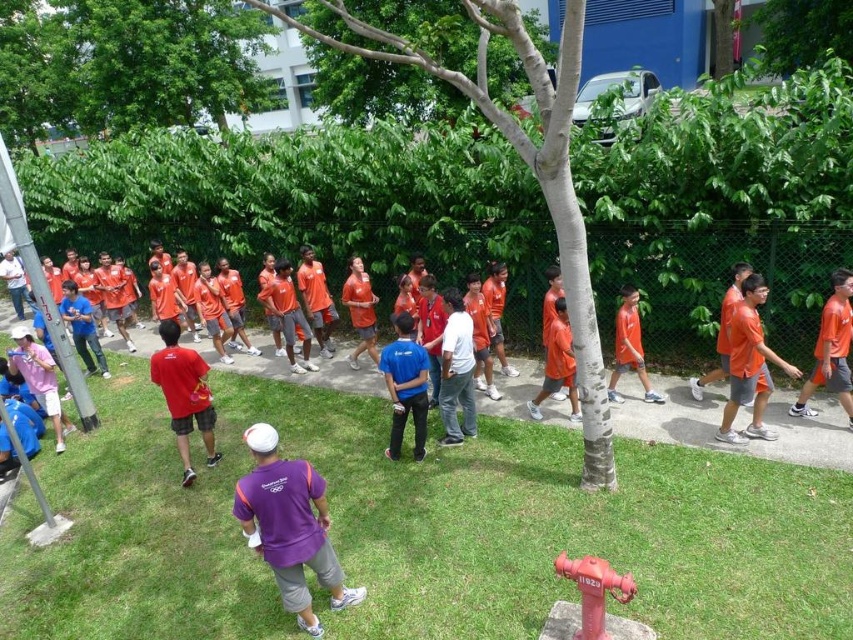
Based on the scene description, can you determine if the smooth bark tree at center is positioned higher than the orange matte shirt at right?

The smooth bark tree at center is above the orange matte shirt at right, so yes, it is positioned higher.

Based on the scene, can you determine if the green leafy tree at upper left is above or below the purple fabric shirt at center?

The green leafy tree at upper left is positioned over the purple fabric shirt at center, so it is above.